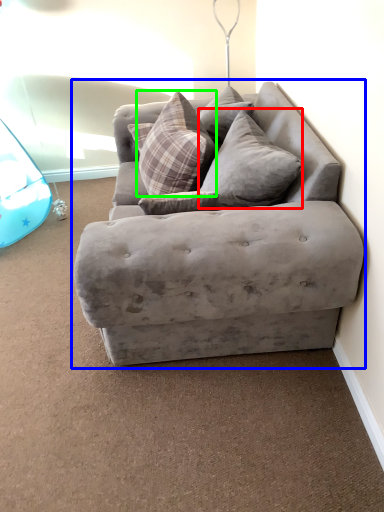
Question: Based on their relative distances, which object is nearer to pillow (highlighted by a red box)? Choose from studio couch (highlighted by a blue box) and pillow (highlighted by a green box).

Choices:
 (A) studio couch
 (B) pillow

Answer: (B)